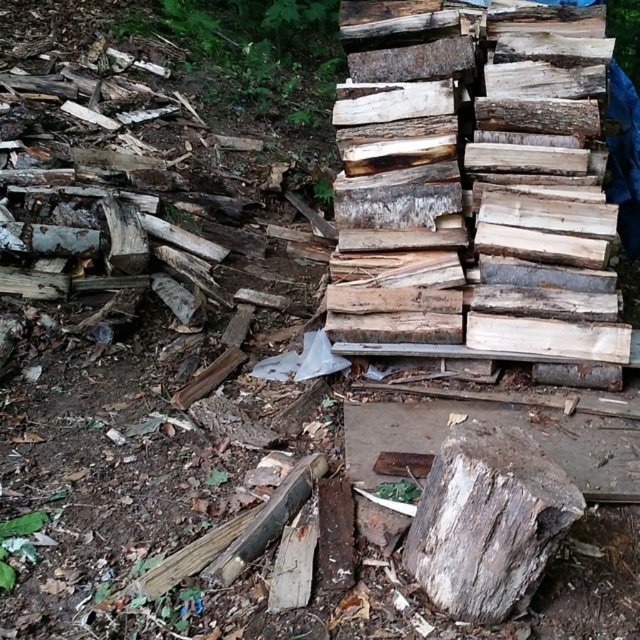
This screenshot has width=640, height=640. What do you see at coordinates (476, 184) in the screenshot?
I see `weathered wood at upper right` at bounding box center [476, 184].

How far apart are weathered wood at upper right and weathered wood stump at center?

weathered wood at upper right is 1.27 meters from weathered wood stump at center.

At what (x,y) coordinates should I click in order to perform the action: click on weathered wood at upper right. Please return your answer as a coordinate pair (x, y). The width and height of the screenshot is (640, 640). Looking at the image, I should click on (476, 184).